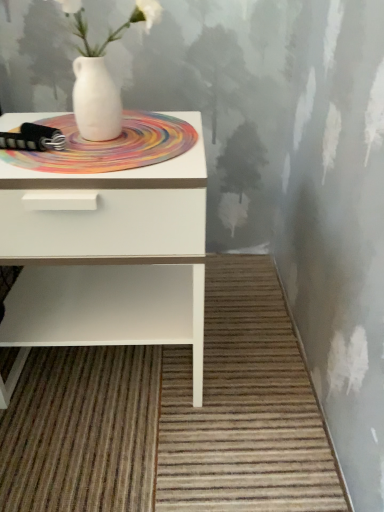
The height and width of the screenshot is (512, 384). What are the coordinates of `free spot in front of white matte vase at upper center` in the screenshot? It's located at (102, 158).